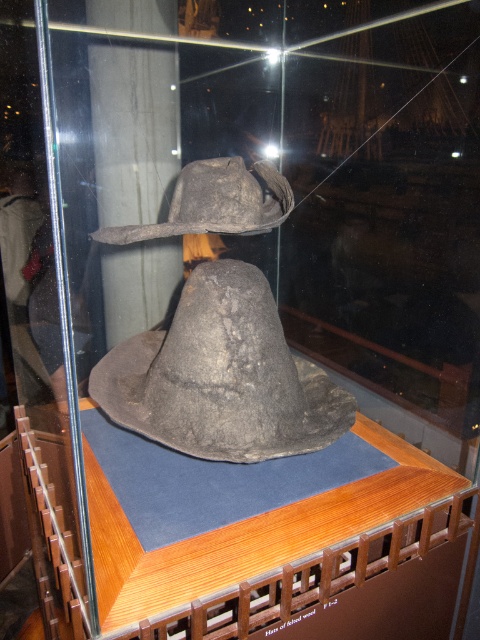
You are a visitor at a museum and want to take a photo of the dark gray felt hat at center. The museum allows photos but requires visitors to stay at least 1.5 meters away from the glass case to avoid reflections. Can you take a clear photo from your current position?

The dark gray felt hat at center and the viewer are 1.22 meters apart. Since the required distance is 1.5 meters, you are too close to take a clear photo without reflections. Move back to comply with the museum rule.

You are a museum guide explaining the layout of the glass case to a visitor. Pointing to the dark gray felt hat at center, you want to indicate its exact position using coordinates. What coordinates should you mention?

The dark gray felt hat at center is located at point (222,376).

You are a museum visitor standing in front of a glass case displaying a historical artifact. The case has a wooden platform with a decorative railing. There is a point marked at coordinates (222,376). What object is located at that point?

The dark gray felt hat at center is represented by point (222,376).